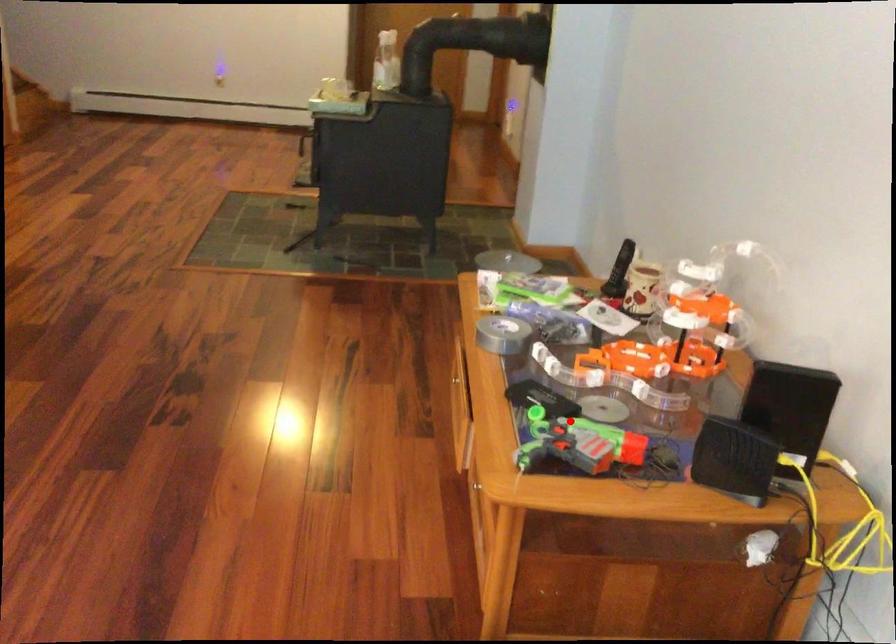
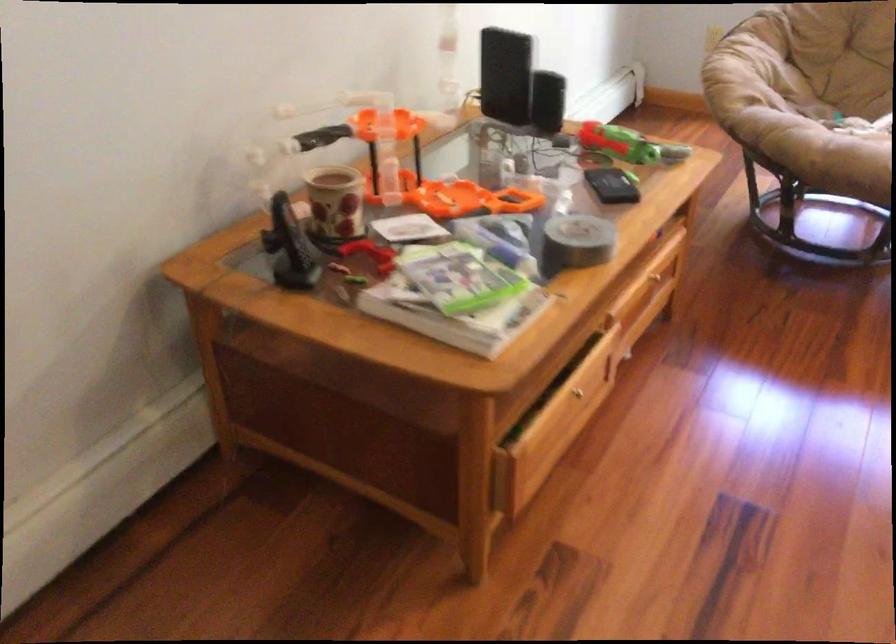
The point at the highlighted location is marked in the first image. Where is the corresponding point in the second image?

(627, 145)